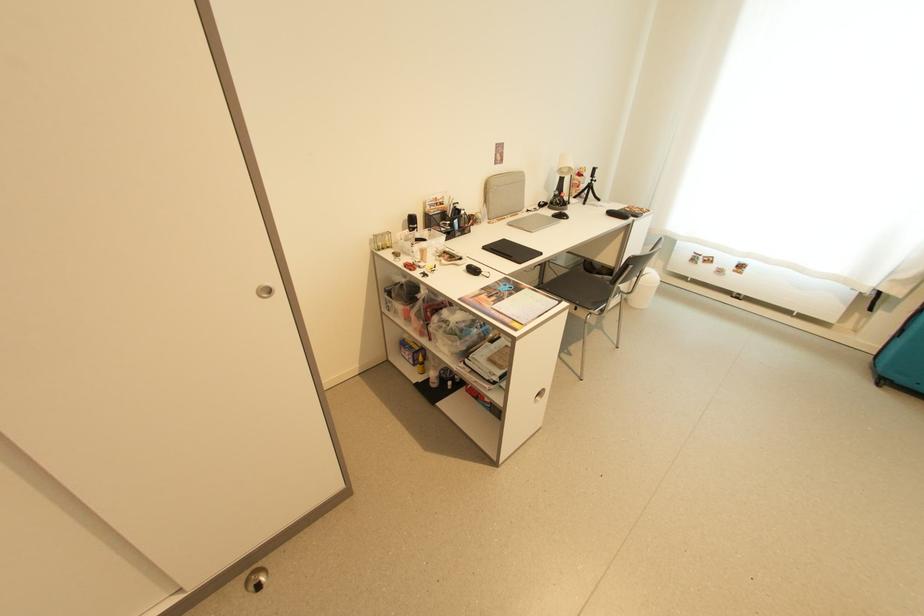
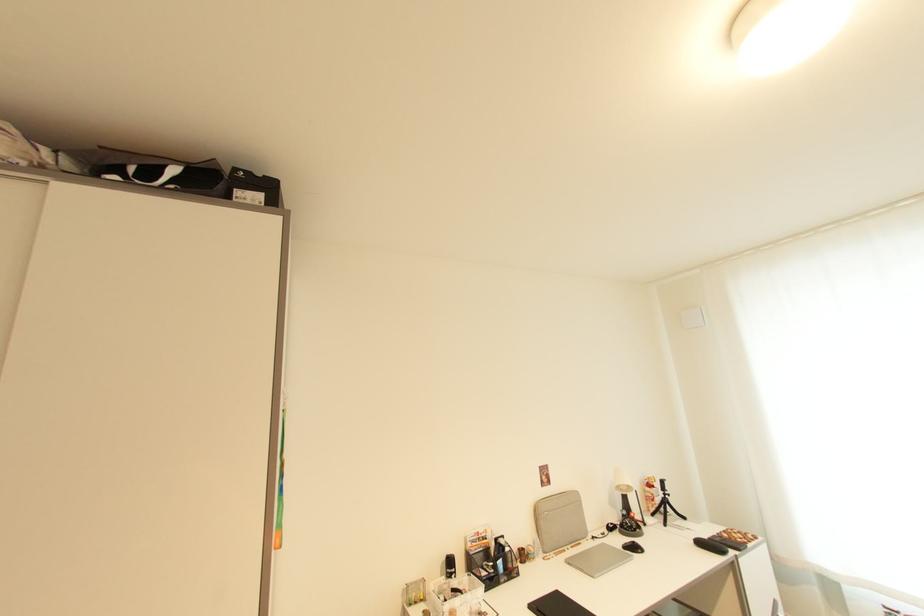
The first image is from the beginning of the video and the second image is from the end. How did the camera likely rotate when shooting the video?

The camera rotated toward left-up.